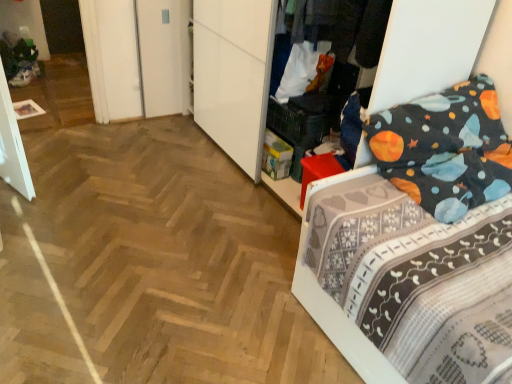
Question: Considering their positions, is dark gray fabric at upper center located in front of or behind dark blue fabric bed at right?

Choices:
 (A) front
 (B) behind

Answer: (B)

Question: Is dark gray fabric at upper center taller or shorter than dark blue fabric bed at right?

Choices:
 (A) tall
 (B) short

Answer: (B)

Question: Would you say dark gray fabric at upper center is to the left or to the right of dark blue fabric bed at right in the picture?

Choices:
 (A) right
 (B) left

Answer: (B)

Question: Considering the positions of dark blue fabric bed at right and dark gray fabric at upper center in the image, is dark blue fabric bed at right wider or thinner than dark gray fabric at upper center?

Choices:
 (A) wide
 (B) thin

Answer: (A)

Question: Considering their positions, is dark blue fabric bed at right located in front of or behind dark gray fabric at upper center?

Choices:
 (A) front
 (B) behind

Answer: (A)

Question: In the image, is dark blue fabric bed at right on the left side or the right side of dark gray fabric at upper center?

Choices:
 (A) right
 (B) left

Answer: (A)

Question: From the image's perspective, is dark blue fabric bed at right above or below dark gray fabric at upper center?

Choices:
 (A) below
 (B) above

Answer: (A)